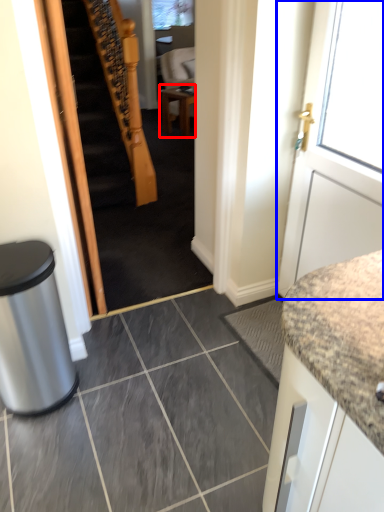
Question: Which of the following is the closest to the observer, table (highlighted by a red box) or door (highlighted by a blue box)?

Choices:
 (A) table
 (B) door

Answer: (B)